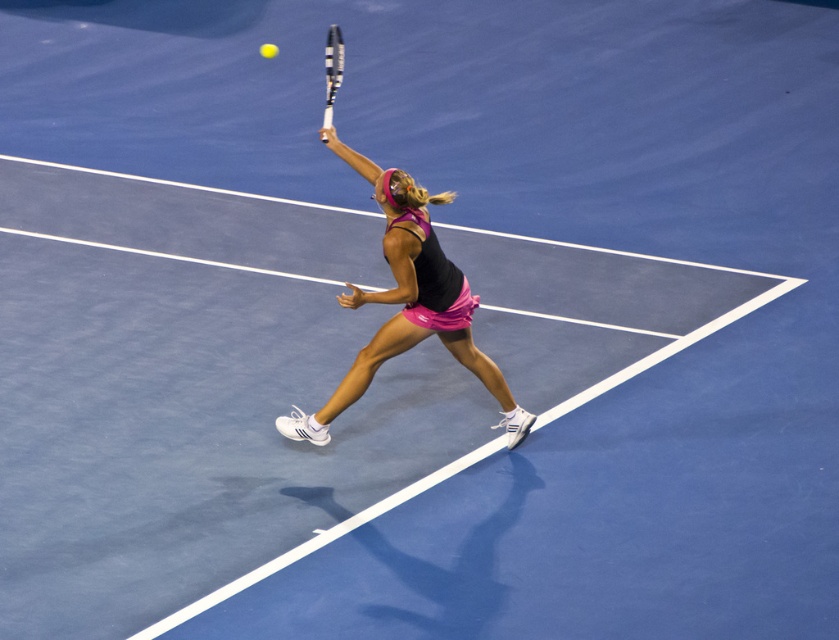
You are standing at the edge of the blue hard court and want to reach the point marked at coordinates (405, 285). If you can move forward 20 feet, will you be able to reach that point?

The point at coordinates (405, 285) is 21.99 feet away from the viewer. Since you can move forward only 20 feet, you will not be able to reach that point.

You are a tennis coach observing a player on the court. You notice the pink fabric tennis skirt at center and the white textured tennis racket at upper center. Which object is positioned more to the right side of the court?

The pink fabric tennis skirt at center is positioned more to the right side of the court compared to the white textured tennis racket at upper center.